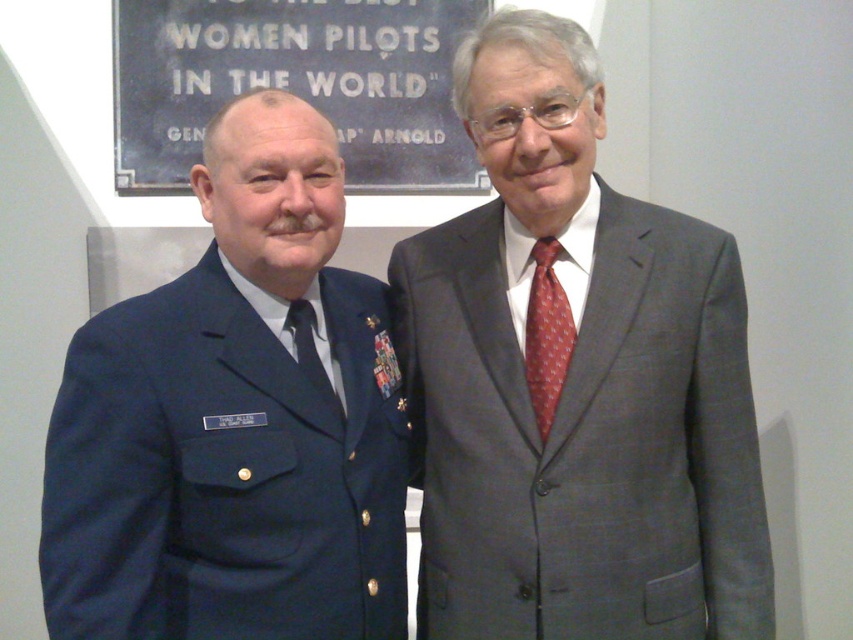
Question: Which point appears closest to the camera in this image?

Choices:
 (A) (556, 381)
 (B) (85, 520)

Answer: (B)

Question: Can you confirm if gray suit at center is positioned to the right of black silk tie at center?

Choices:
 (A) yes
 (B) no

Answer: (A)

Question: Which of the following is the farthest from the observer?

Choices:
 (A) (549, 355)
 (B) (375, 4)

Answer: (B)

Question: Does navy blue uniform at left lie behind red silk tie at right?

Choices:
 (A) yes
 (B) no

Answer: (B)

Question: Which point is closer to the camera?

Choices:
 (A) click(305, 305)
 (B) click(544, 422)
 (C) click(485, 630)

Answer: (C)

Question: Can you confirm if gray suit at center is thinner than black silk tie at center?

Choices:
 (A) no
 (B) yes

Answer: (A)